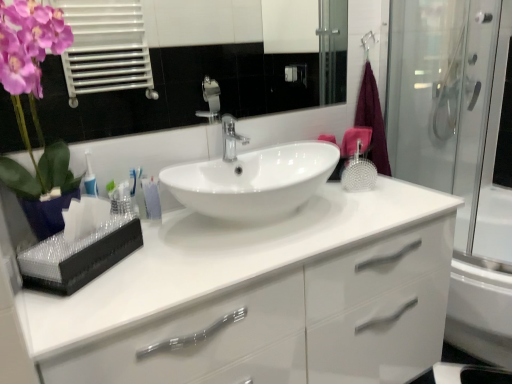
Locate an element on the screen. free spot to the right of translucent plastic toothbrushes at left is located at coordinates (195, 227).